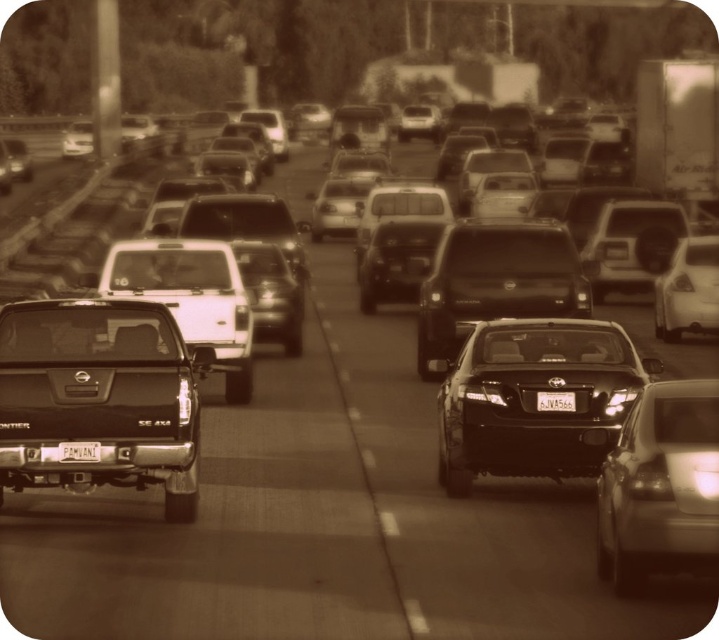
Who is higher up, shiny silver sedan at center or matte white truck at center?

matte white truck at center is above.

The height and width of the screenshot is (640, 719). What do you see at coordinates (659, 484) in the screenshot?
I see `shiny silver sedan at center` at bounding box center [659, 484].

The width and height of the screenshot is (719, 640). Find the location of `shiny silver sedan at center`. shiny silver sedan at center is located at coordinates (659, 484).

The image size is (719, 640). I want to click on shiny silver sedan at center, so click(x=659, y=484).

Is point (631, 422) more distant than point (554, 250)?

No.

Is shiny silver sedan at center wider than matte black sedan at center?

No.

Which is behind, point (679, 536) or point (462, 310)?

The point (462, 310) is more distant.

At what (x,y) coordinates should I click in order to perform the action: click on shiny silver sedan at center. Please return your answer as a coordinate pair (x, y). The image size is (719, 640). Looking at the image, I should click on (659, 484).

Does matte black sedan at center have a lesser height compared to metallic silver sedan at right?

In fact, matte black sedan at center may be taller than metallic silver sedan at right.

This screenshot has height=640, width=719. What do you see at coordinates (495, 280) in the screenshot?
I see `matte black sedan at center` at bounding box center [495, 280].

Where is `matte black sedan at center`? The width and height of the screenshot is (719, 640). matte black sedan at center is located at coordinates (495, 280).